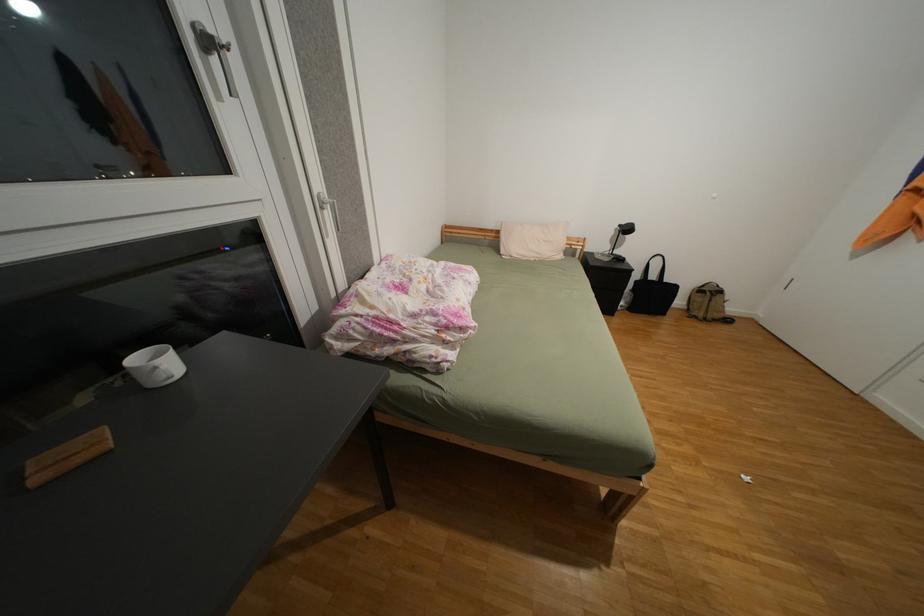
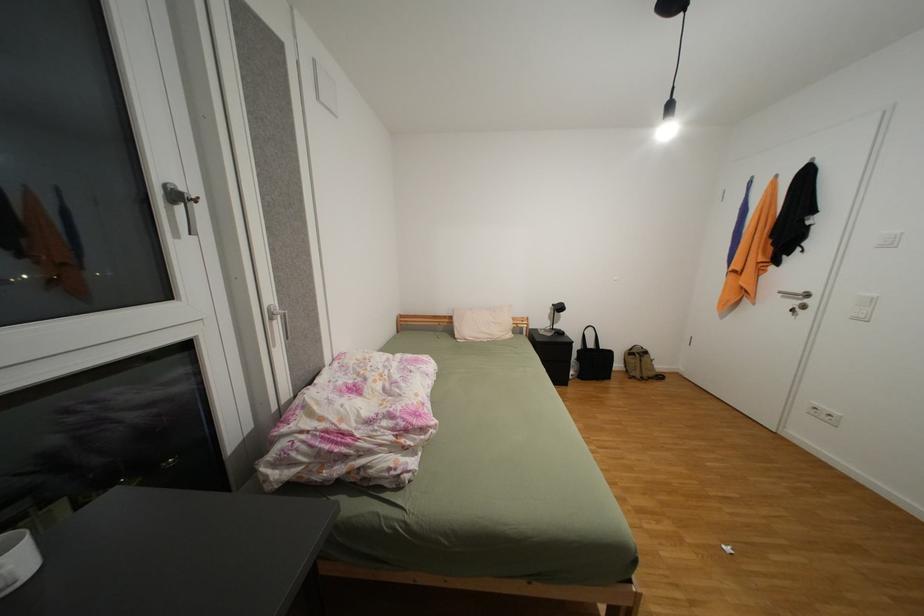
Question: In a continuous first-person perspective shot, in which direction is the camera moving?

Choices:
 (A) Left
 (B) Right
 (C) Forward
 (D) Backward

Answer: (D)